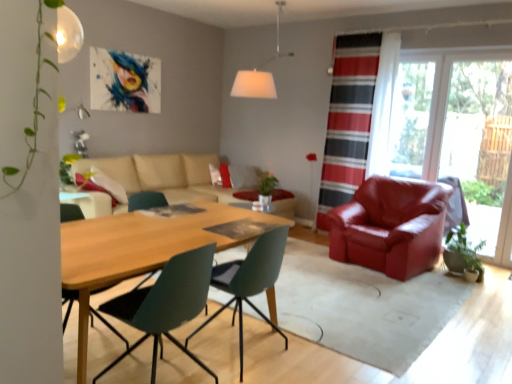
Question: Is beige fabric couch at center a part of white fabric lampshade at upper center?

Choices:
 (A) yes
 (B) no

Answer: (B)

Question: From the image's perspective, is white fabric lampshade at upper center under beige fabric couch at center?

Choices:
 (A) no
 (B) yes

Answer: (A)

Question: Considering the relative sizes of white fabric lampshade at upper center and beige fabric couch at center in the image provided, is white fabric lampshade at upper center taller than beige fabric couch at center?

Choices:
 (A) no
 (B) yes

Answer: (B)

Question: From a real-world perspective, does white fabric lampshade at upper center sit lower than beige fabric couch at center?

Choices:
 (A) yes
 (B) no

Answer: (B)

Question: From a real-world perspective, does white fabric lampshade at upper center stand above beige fabric couch at center?

Choices:
 (A) yes
 (B) no

Answer: (A)

Question: Looking at the image, does satin red armchair at right, which is the 3th chair from front to back, seem bigger or smaller compared to green matte houseplant at lower right?

Choices:
 (A) big
 (B) small

Answer: (A)

Question: Which is correct: satin red armchair at right, placed as the first chair when sorted from right to left, is inside green matte houseplant at lower right, or outside of it?

Choices:
 (A) inside
 (B) outside

Answer: (B)

Question: Looking at their shapes, would you say satin red armchair at right, which is the 3th chair from front to back, is wider or thinner than green matte houseplant at lower right?

Choices:
 (A) thin
 (B) wide

Answer: (B)

Question: From their relative heights in the image, would you say satin red armchair at right, which is the 3th chair from front to back, is taller or shorter than green matte houseplant at lower right?

Choices:
 (A) tall
 (B) short

Answer: (A)

Question: Is wooden table at center in front of or behind satin red armchair at right, which is the 3th chair from front to back, in the image?

Choices:
 (A) front
 (B) behind

Answer: (A)

Question: From the image's perspective, is wooden table at center located above or below satin red armchair at right, the 3th chair positioned from the left?

Choices:
 (A) above
 (B) below

Answer: (A)

Question: In terms of size, does wooden table at center appear bigger or smaller than satin red armchair at right, the 3th chair positioned from the left?

Choices:
 (A) small
 (B) big

Answer: (B)

Question: Is wooden table at center inside the boundaries of satin red armchair at right, the 3th chair positioned from the left, or outside?

Choices:
 (A) outside
 (B) inside

Answer: (A)

Question: Is point (285, 230) closer or farther from the camera than point (401, 160)?

Choices:
 (A) closer
 (B) farther

Answer: (A)

Question: From a real-world perspective, is matte green chair at center, acting as the 2th chair starting from the front, above or below transparent plastic window screen at upper right?

Choices:
 (A) above
 (B) below

Answer: (B)